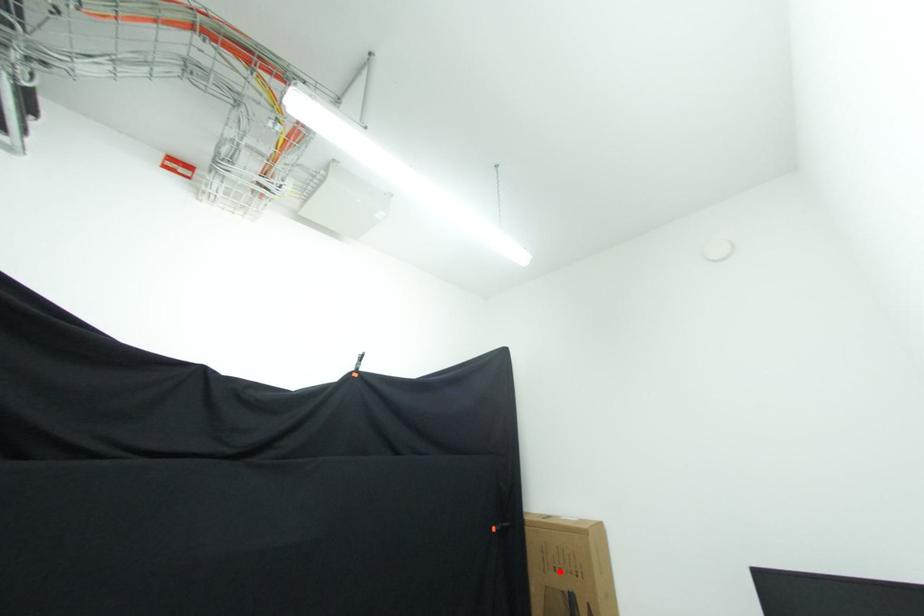
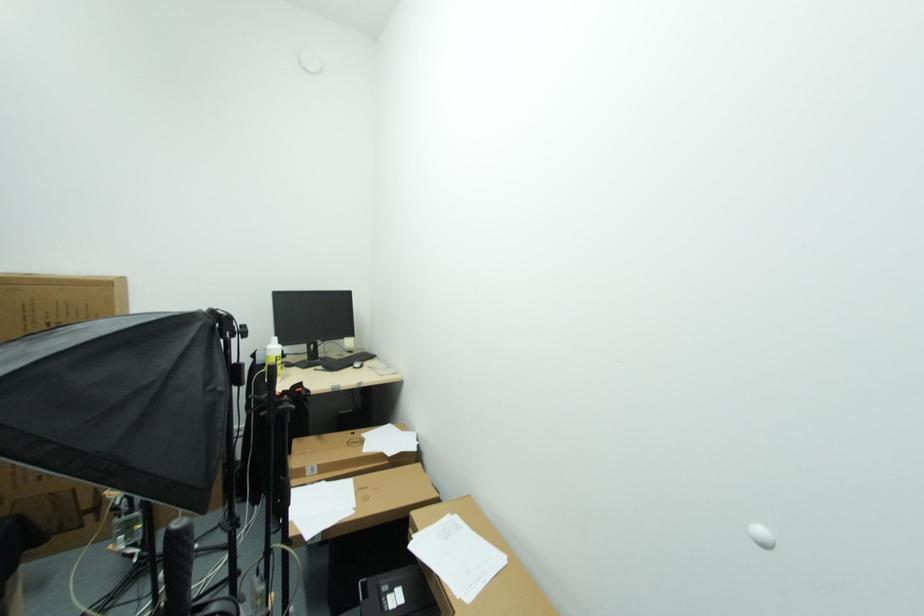
Question: I am providing you with two images of the same scene from different viewpoints. In image1, a red point is highlighted. Considering the same 3D point in image2, which of the following is correct?

Choices:
 (A) It is closer
 (B) It is farther

Answer: (B)